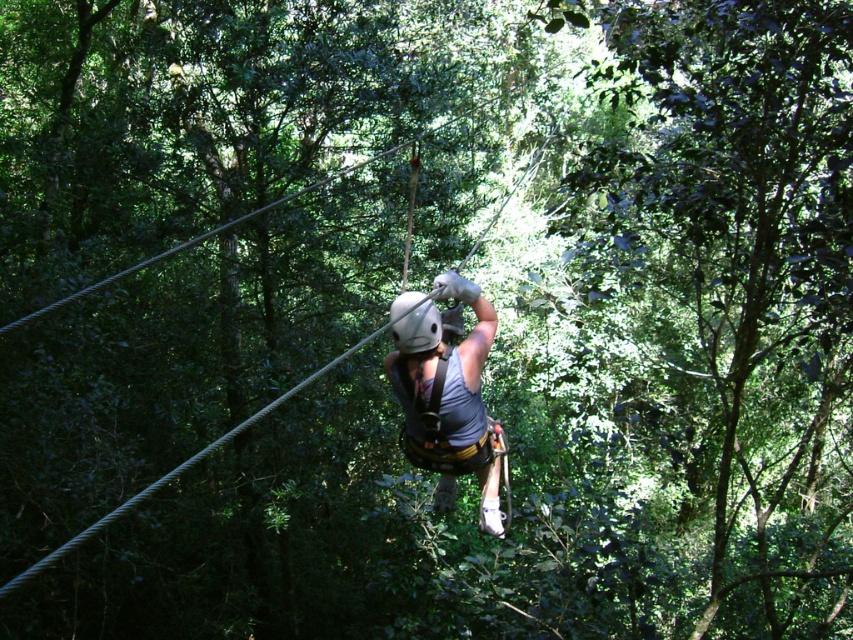
Between green leafy tree at center and gray fabric harness at center, which one appears on the right side from the viewer's perspective?

From the viewer's perspective, green leafy tree at center appears more on the right side.

Between point (767, 292) and point (421, 365), which one is positioned in front?

Point (421, 365)

At what (x,y) coordinates should I click in order to perform the action: click on green leafy tree at center. Please return your answer as a coordinate pair (x, y). This screenshot has width=853, height=640. Looking at the image, I should click on (734, 282).